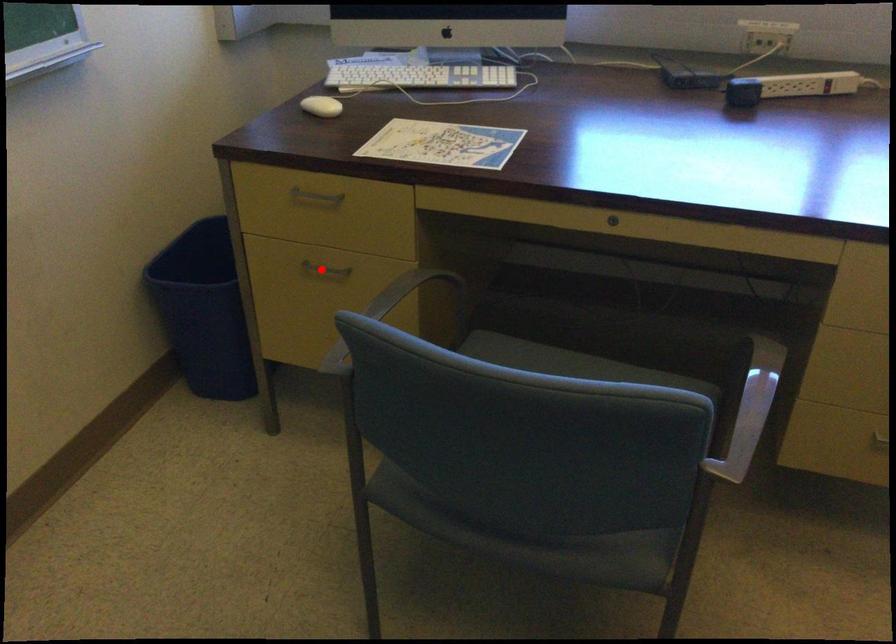
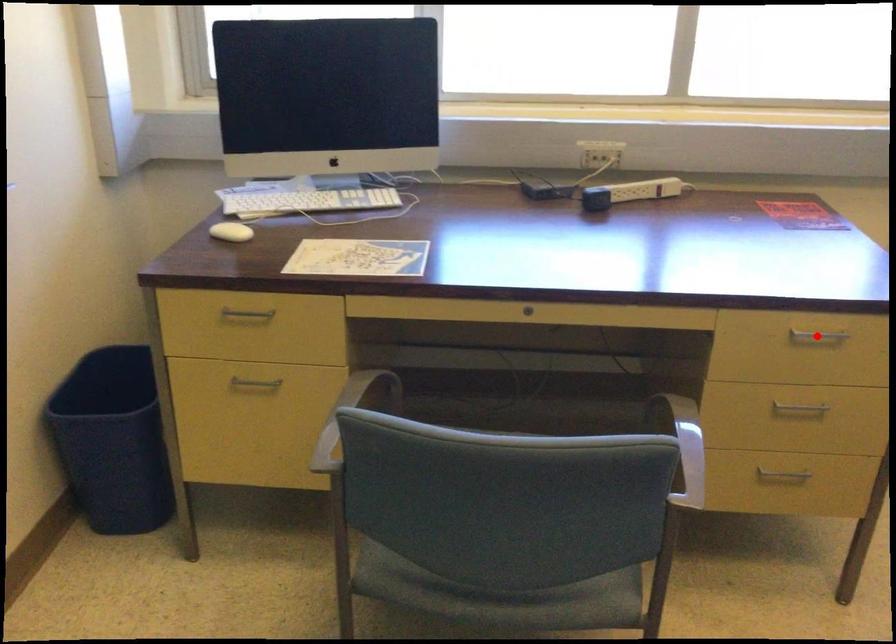
I am providing you with two images of the same scene from different viewpoints. A red point is marked on the first image and another point is marked on the second image. Is the red point in image1 aligned with the point shown in image2?

No